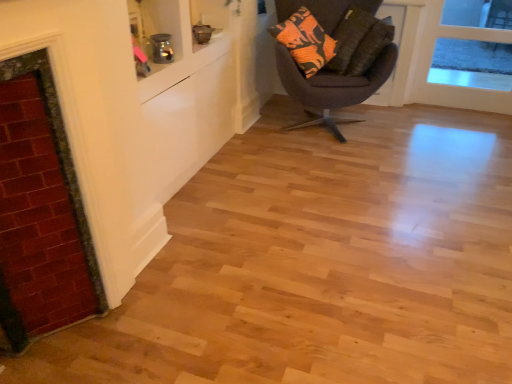
Question: Is orange printed fabric pillow at upper right, marked as the 1th pillow in a front-to-back arrangement, thinner than red brick fireplace at left?

Choices:
 (A) no
 (B) yes

Answer: (A)

Question: Is orange printed fabric pillow at upper right, marked as the 1th pillow in a front-to-back arrangement, wider than red brick fireplace at left?

Choices:
 (A) yes
 (B) no

Answer: (A)

Question: Is orange printed fabric pillow at upper right, acting as the second pillow starting from the back, positioned beyond the bounds of red brick fireplace at left?

Choices:
 (A) no
 (B) yes

Answer: (B)

Question: From a real-world perspective, is orange printed fabric pillow at upper right, marked as the 1th pillow in a front-to-back arrangement, located beneath red brick fireplace at left?

Choices:
 (A) no
 (B) yes

Answer: (A)

Question: Can you confirm if orange printed fabric pillow at upper right, acting as the second pillow starting from the back, is bigger than red brick fireplace at left?

Choices:
 (A) no
 (B) yes

Answer: (B)

Question: Considering their positions, is dark brown fabric chair at center located in front of or behind orange patterned pillow at upper right, the first pillow when ordered from back to front?

Choices:
 (A) front
 (B) behind

Answer: (A)

Question: Considering the relative positions of dark brown fabric chair at center and orange patterned pillow at upper right, which is counted as the second pillow, starting from the front, in the image provided, is dark brown fabric chair at center to the left or to the right of orange patterned pillow at upper right, which is counted as the second pillow, starting from the front,?

Choices:
 (A) left
 (B) right

Answer: (A)

Question: Considering the positions of dark brown fabric chair at center and orange patterned pillow at upper right, which is counted as the second pillow, starting from the front, in the image, is dark brown fabric chair at center bigger or smaller than orange patterned pillow at upper right, which is counted as the second pillow, starting from the front,?

Choices:
 (A) big
 (B) small

Answer: (A)

Question: Considering the positions of point (295, 74) and point (352, 54), is point (295, 74) closer or farther from the camera than point (352, 54)?

Choices:
 (A) closer
 (B) farther

Answer: (A)

Question: Considering their positions, is orange printed fabric pillow at upper right, acting as the second pillow starting from the back, located in front of or behind orange patterned pillow at upper right, which is counted as the second pillow, starting from the front?

Choices:
 (A) front
 (B) behind

Answer: (A)

Question: Is point (369, 52) closer or farther from the camera than point (337, 66)?

Choices:
 (A) closer
 (B) farther

Answer: (A)

Question: Considering the positions of orange printed fabric pillow at upper right, marked as the 1th pillow in a front-to-back arrangement, and orange patterned pillow at upper right, the first pillow when ordered from back to front, in the image, is orange printed fabric pillow at upper right, marked as the 1th pillow in a front-to-back arrangement, bigger or smaller than orange patterned pillow at upper right, the first pillow when ordered from back to front,?

Choices:
 (A) small
 (B) big

Answer: (A)

Question: From a real-world perspective, relative to orange patterned pillow at upper right, which is counted as the second pillow, starting from the front, is orange printed fabric pillow at upper right, acting as the second pillow starting from the back, vertically above or below?

Choices:
 (A) above
 (B) below

Answer: (B)

Question: Looking at the image, does orange printed fabric pillow at upper right, acting as the second pillow starting from the back, seem bigger or smaller compared to transparent glass door at upper right?

Choices:
 (A) big
 (B) small

Answer: (B)

Question: From a real-world perspective, is orange printed fabric pillow at upper right, acting as the second pillow starting from the back, positioned above or below transparent glass door at upper right?

Choices:
 (A) below
 (B) above

Answer: (B)